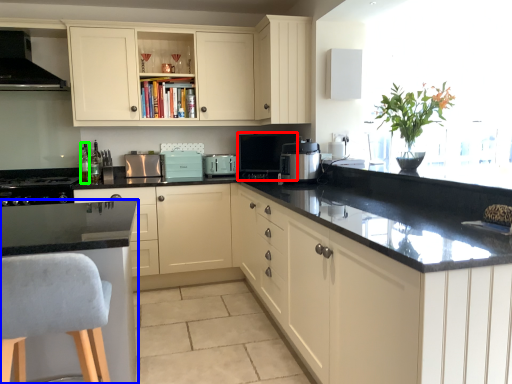
Question: Estimate the real-world distances between objects in this image. Which object is farther from coffee machine (highlighted by a red box), countertop (highlighted by a blue box) or bottle (highlighted by a green box)?

Choices:
 (A) countertop
 (B) bottle

Answer: (B)